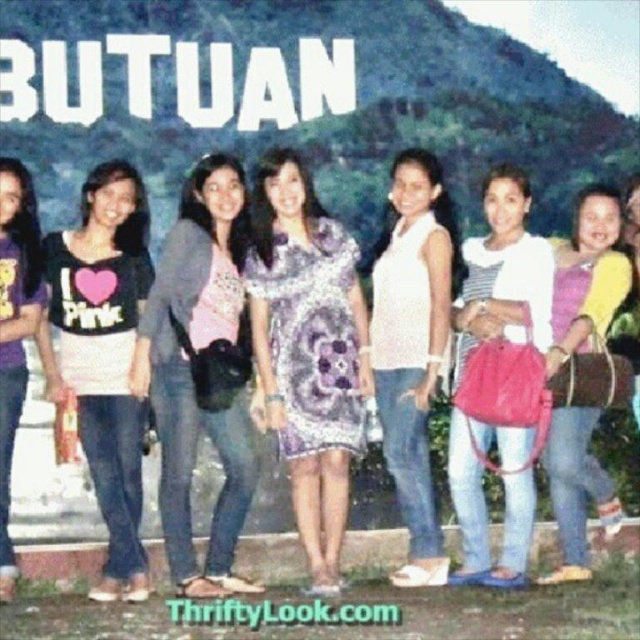
Does matte black t-shirt at center have a smaller size compared to matte black t-shirt at left?

Actually, matte black t-shirt at center might be larger than matte black t-shirt at left.

Which is behind, point (125, 374) or point (10, 205)?

Positioned behind is point (125, 374).

Is point (104, 339) more distant than point (13, 426)?

That is True.

Where is `matte black t-shirt at center`? matte black t-shirt at center is located at coordinates (104, 355).

Does purple printed dress at center have a greater height compared to matte gray sweater at center?

No, purple printed dress at center is not taller than matte gray sweater at center.

Can you confirm if purple printed dress at center is positioned above matte gray sweater at center?

No, purple printed dress at center is not above matte gray sweater at center.

Describe the element at coordinates (308, 349) in the screenshot. This screenshot has width=640, height=640. I see `purple printed dress at center` at that location.

In order to click on purple printed dress at center in this screenshot , I will do `click(308, 349)`.

Is point (394, 400) farther from camera compared to point (612, 291)?

Yes, it is behind point (612, 291).

Identify the location of white matte tank top at center. The image size is (640, 640). (412, 346).